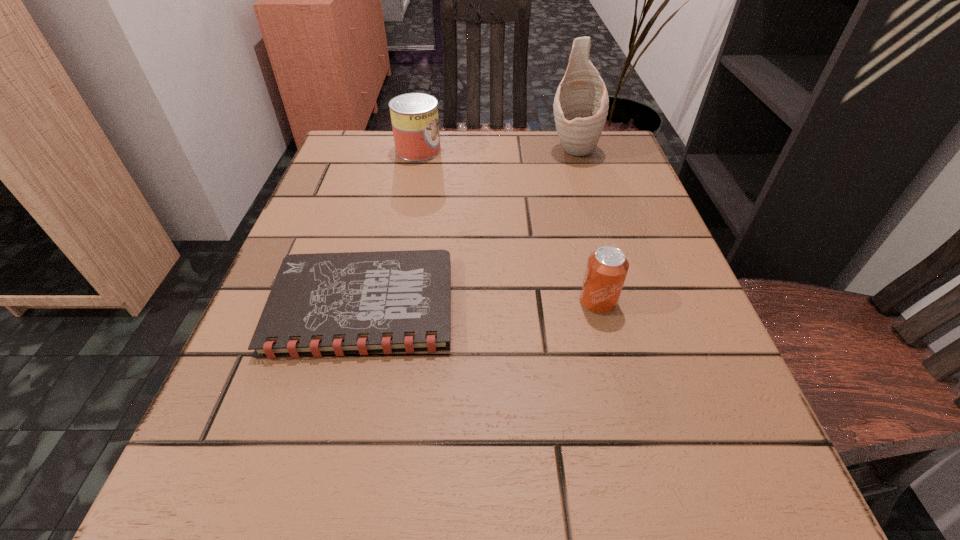
Identify the location of pitcher. This screenshot has height=540, width=960. (581, 103).

At what (x,y) coordinates should I click in order to perform the action: click on the farther can. Please return your answer as a coordinate pair (x, y). This screenshot has width=960, height=540. Looking at the image, I should click on (414, 116).

This screenshot has height=540, width=960. In order to click on the second shortest object in this screenshot , I will do `click(607, 267)`.

Where is `the nearer can`? the nearer can is located at coordinates (607, 267).

Find the location of a particular element. the shortest object is located at coordinates (320, 304).

I want to click on vacant space situated at the spout of the pitcher, so point(583,181).

What are the coordinates of `free space located on the front of the farther can` in the screenshot? It's located at (414, 173).

Where is `free spot located on the back of the nearer can`? This screenshot has height=540, width=960. free spot located on the back of the nearer can is located at coordinates (569, 190).

Find the location of a particular element. The image size is (960, 540). vacant area situated on the right of the notebook is located at coordinates (547, 305).

At what (x,y) coordinates should I click in order to perform the action: click on pitcher that is at the far edge. Please return your answer as a coordinate pair (x, y). Image resolution: width=960 pixels, height=540 pixels. Looking at the image, I should click on (581, 103).